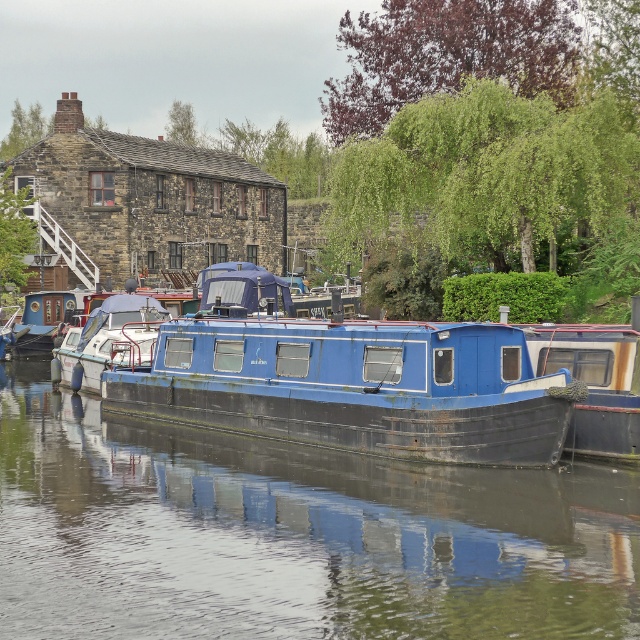
Does smooth dark blue boat at center have a smaller size compared to blue painted wood boat at center?

Incorrect, smooth dark blue boat at center is not smaller in size than blue painted wood boat at center.

Locate an element on the screen. The width and height of the screenshot is (640, 640). smooth dark blue boat at center is located at coordinates pyautogui.click(x=292, y=536).

The height and width of the screenshot is (640, 640). What are the coordinates of `smooth dark blue boat at center` in the screenshot? It's located at (292, 536).

Is blue matte barge at center thinner than blue painted wood boat at center?

No, blue matte barge at center is not thinner than blue painted wood boat at center.

Between blue matte barge at center and blue painted wood boat at center, which one has more height?

With more height is blue matte barge at center.

Which is behind, point (339, 429) or point (582, 353)?

Point (339, 429)

Find the location of a particular element. blue matte barge at center is located at coordinates (356, 387).

What do you see at coordinates (292, 536) in the screenshot?
I see `smooth dark blue boat at center` at bounding box center [292, 536].

Can you confirm if smooth dark blue boat at center is positioned to the right of blue matte barge at center?

Incorrect, smooth dark blue boat at center is not on the right side of blue matte barge at center.

From the picture: Who is more distant from viewer, (x=483, y=596) or (x=218, y=416)?

Point (x=218, y=416)

Where is `smooth dark blue boat at center`? smooth dark blue boat at center is located at coordinates (292, 536).